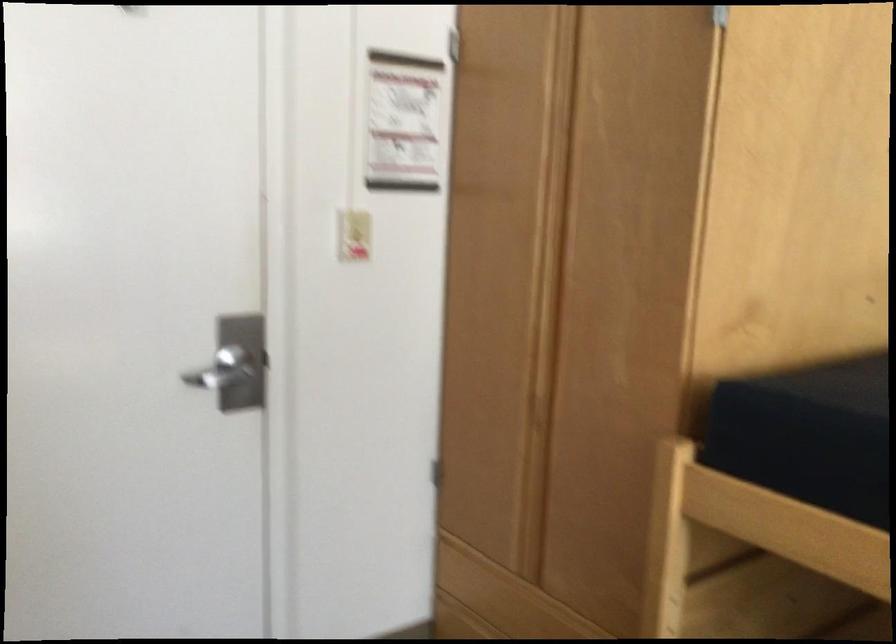
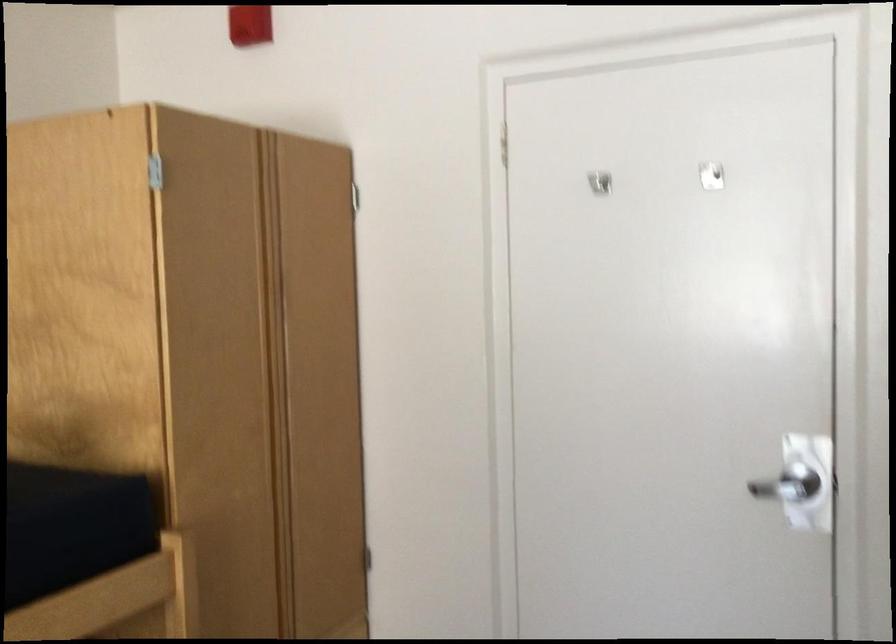
Question: Based on the continuous images, in which direction is the camera rotating? Reply with the corresponding letter.

Choices:
 (A) Left
 (B) Right
 (C) Up
 (D) Down

Answer: (A)